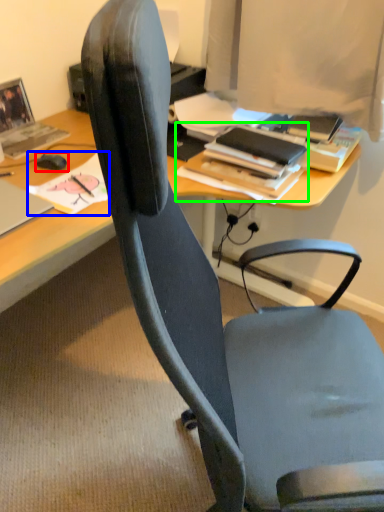
Question: Estimate the real-world distances between objects in this image. Which object is farther from mouse (highlighted by a red box), book (highlighted by a blue box) or book (highlighted by a green box)?

Choices:
 (A) book
 (B) book

Answer: (B)